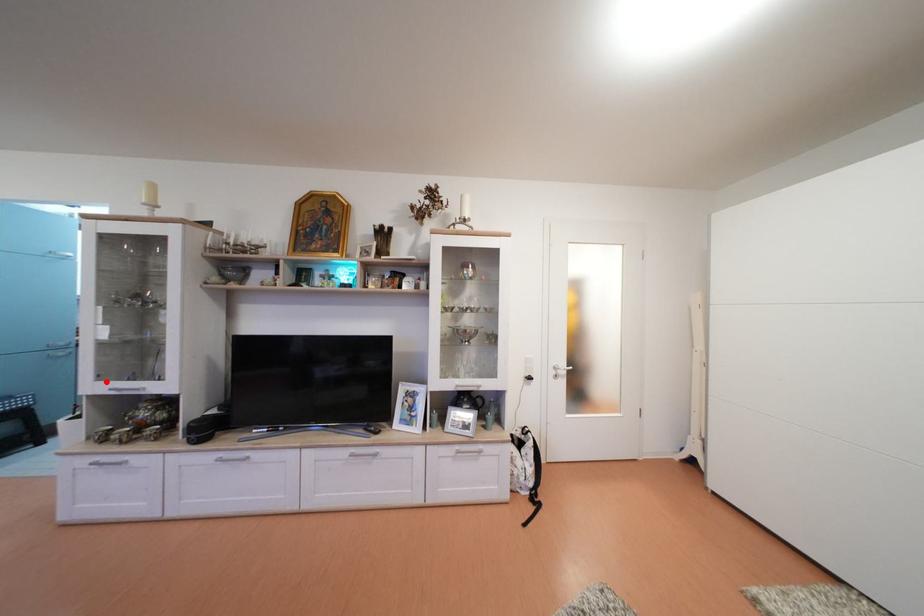
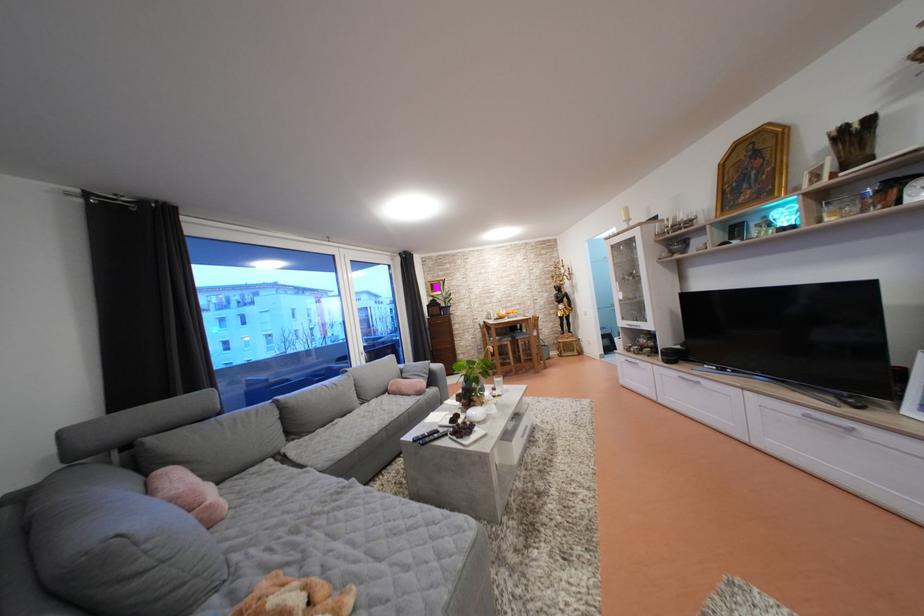
Question: I am providing you with two images of the same scene from different viewpoints. Image1 has a red point marked. In image2, the corresponding 3D location appears at what relative position? Reply with the corresponding letter.

Choices:
 (A) Closer
 (B) Farther

Answer: (B)